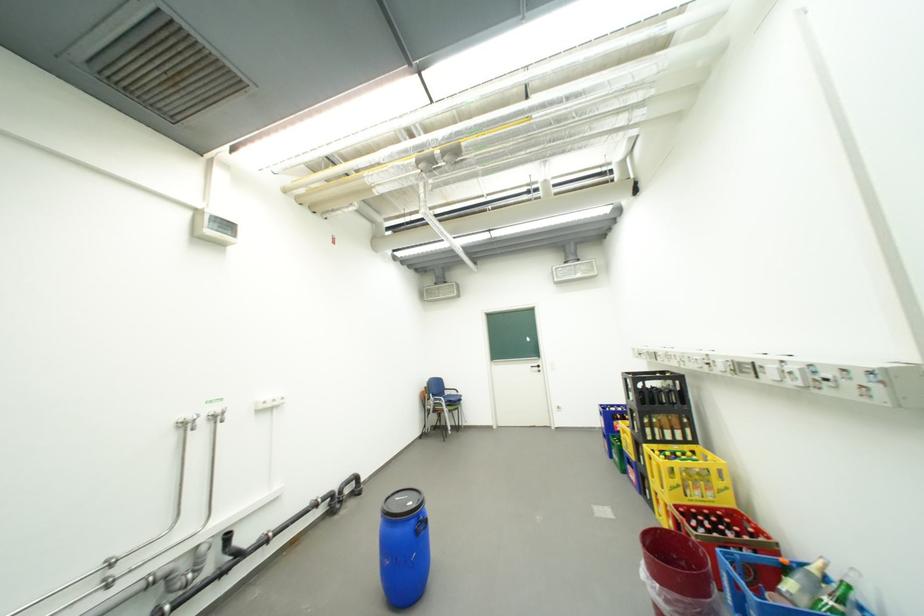
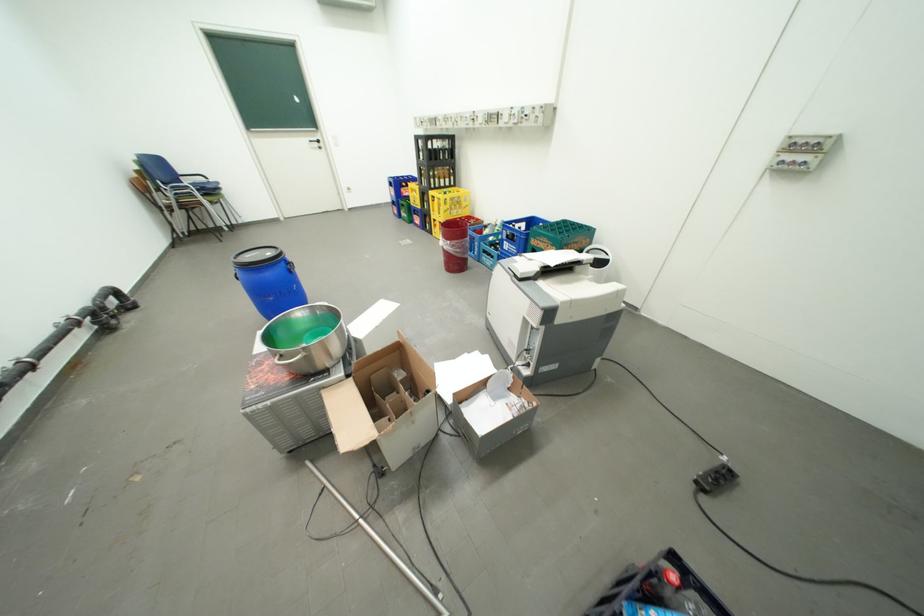
In the second image, find the point that corresponds to (x=422, y=519) in the first image.

(290, 262)